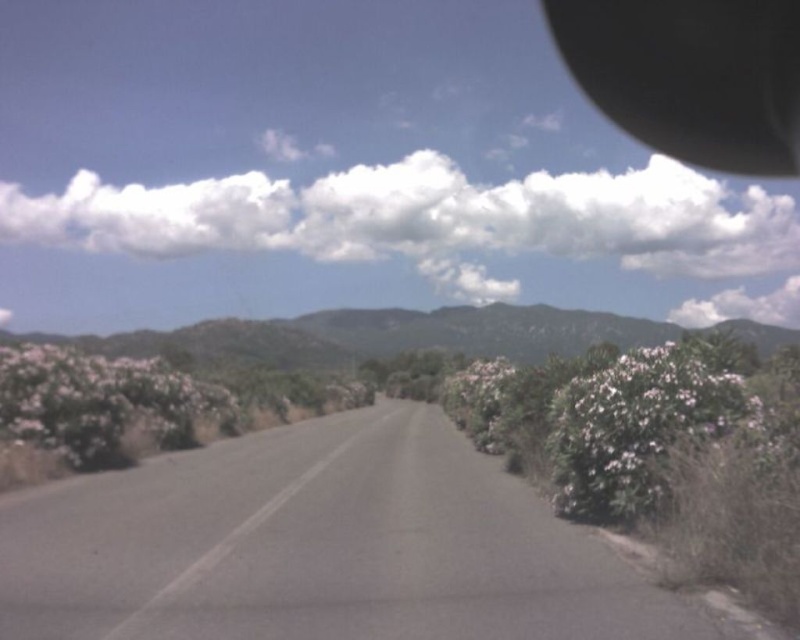
Question: Is gray asphalt road at center in front of white fluffy cloud at upper center?

Choices:
 (A) yes
 (B) no

Answer: (A)

Question: Can you confirm if white fluffy cloud at upper center is positioned above green textured mountain at center?

Choices:
 (A) no
 (B) yes

Answer: (B)

Question: Which point is closer to the camera taking this photo?

Choices:
 (A) (570, 61)
 (B) (318, 330)

Answer: (B)

Question: Estimate the real-world distances between objects in this image. Which object is closer to the gray asphalt road at center?

Choices:
 (A) green textured mountain at center
 (B) black rubber view mirror at upper right
 (C) white fluffy cloud at upper center

Answer: (B)

Question: Is the position of white fluffy cloud at upper center less distant than that of black rubber view mirror at upper right?

Choices:
 (A) yes
 (B) no

Answer: (B)

Question: Which of the following is the farthest from the observer?

Choices:
 (A) gray asphalt road at center
 (B) white fluffy cloud at upper center

Answer: (B)